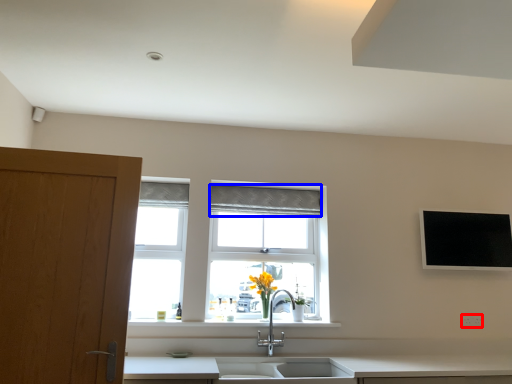
Question: Among these objects, which one is farthest to the camera, electric outlet (highlighted by a red box) or curtain (highlighted by a blue box)?

Choices:
 (A) electric outlet
 (B) curtain

Answer: (B)